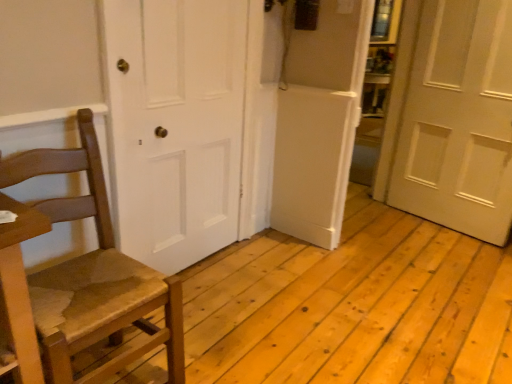
Question: Does wooden chair at left come in front of white matte door at right, the second door in the left-to-right sequence?

Choices:
 (A) yes
 (B) no

Answer: (A)

Question: Is wooden chair at left thinner than white matte door at right, the second door in the left-to-right sequence?

Choices:
 (A) no
 (B) yes

Answer: (A)

Question: Is wooden chair at left not near white matte door at right, positioned as the first door in right-to-left order?

Choices:
 (A) no
 (B) yes

Answer: (B)

Question: Is white matte door at right, the second door in the left-to-right sequence, located within wooden chair at left?

Choices:
 (A) yes
 (B) no

Answer: (B)

Question: From a real-world perspective, does wooden chair at left stand above white matte door at right, positioned as the first door in right-to-left order?

Choices:
 (A) yes
 (B) no

Answer: (B)

Question: Does wooden chair at left have a lesser height compared to white matte door at right, the second door in the left-to-right sequence?

Choices:
 (A) yes
 (B) no

Answer: (A)

Question: From the image's perspective, is white matte door at right, the second door in the left-to-right sequence, over wooden chair at left?

Choices:
 (A) no
 (B) yes

Answer: (B)

Question: Does white matte door at right, the second door in the left-to-right sequence, turn towards wooden chair at left?

Choices:
 (A) yes
 (B) no

Answer: (A)

Question: From a real-world perspective, does white matte door at right, positioned as the first door in right-to-left order, sit lower than wooden chair at left?

Choices:
 (A) no
 (B) yes

Answer: (A)

Question: Does white matte door at right, positioned as the first door in right-to-left order, have a greater width compared to wooden chair at left?

Choices:
 (A) no
 (B) yes

Answer: (A)

Question: Does white matte door at right, the second door in the left-to-right sequence, appear on the left side of wooden chair at left?

Choices:
 (A) yes
 (B) no

Answer: (B)

Question: Considering the relative sizes of white matte door at right, positioned as the first door in right-to-left order, and wooden chair at left in the image provided, is white matte door at right, positioned as the first door in right-to-left order, bigger than wooden chair at left?

Choices:
 (A) no
 (B) yes

Answer: (A)

Question: Is the surface of white matte door at center, which is counted as the 1th door, starting from the left, in direct contact with wooden chair at left?

Choices:
 (A) yes
 (B) no

Answer: (B)